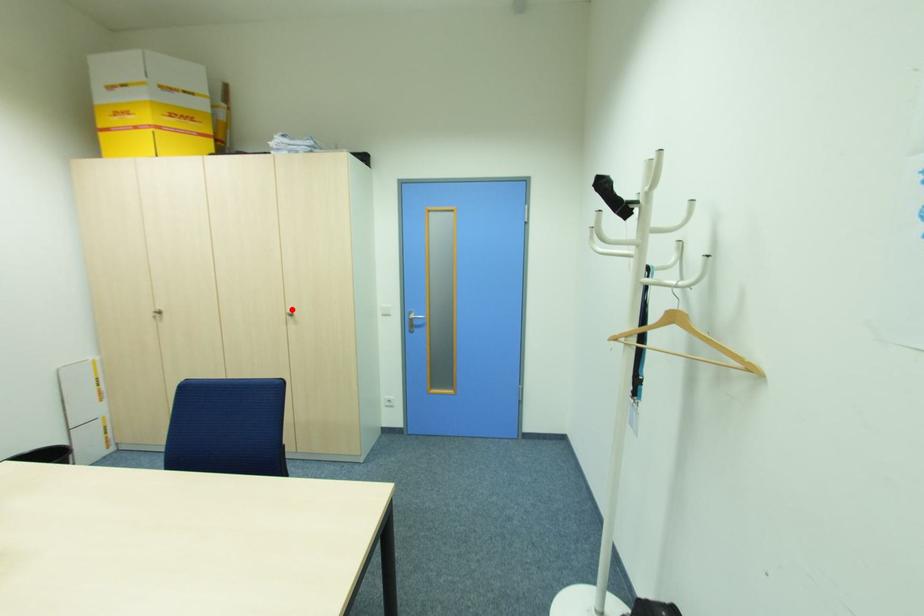
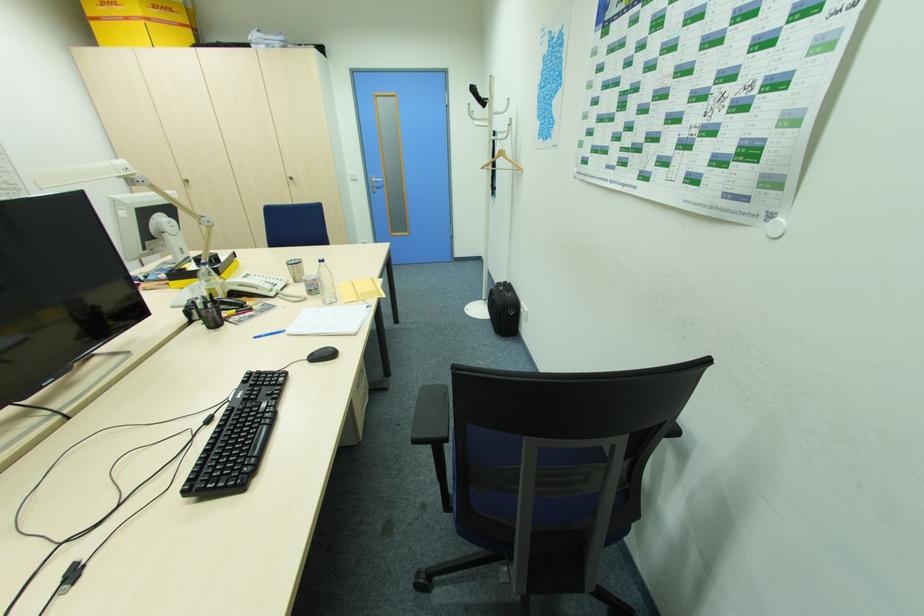
The point at the highlighted location is marked in the first image. Where is the corresponding point in the second image?

(292, 176)